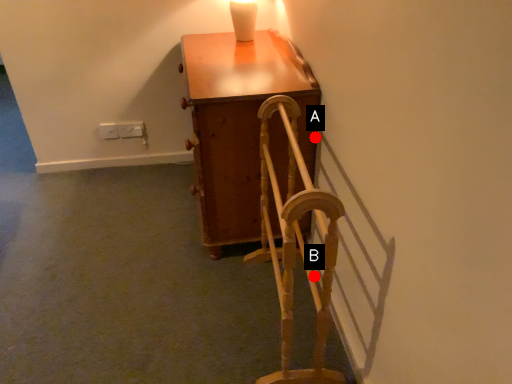
Question: Two points are circled on the image, labeled by A and B beside each circle. Among these points, which one is farthest from the camera?

Choices:
 (A) A is further
 (B) B is further

Answer: (A)